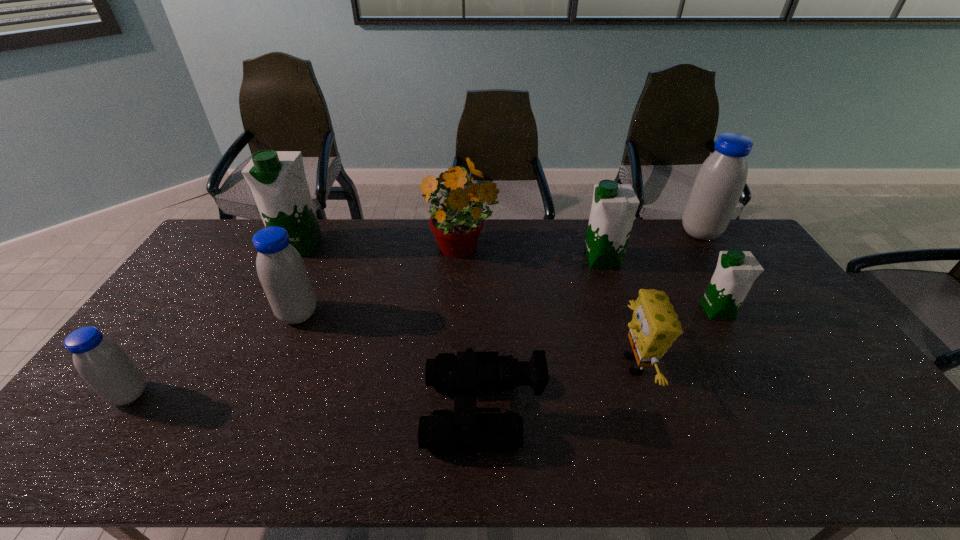
The width and height of the screenshot is (960, 540). What are the coordinates of `free space located 0.090m on the front lenses of the shortest object` in the screenshot? It's located at (389, 410).

Locate an element on the screen. The image size is (960, 540). flowerpot that is at the far edge is located at coordinates (456, 226).

I want to click on object that is at the near edge, so click(469, 372).

Find the location of `object at the left edge`. object at the left edge is located at coordinates (103, 364).

Identify the location of object located at the right edge. This screenshot has height=540, width=960. (719, 183).

You are a GUI agent. You are given a task and a screenshot of the screen. Output one action in this format:
    pyautogui.click(x=<x>, y=<y>)
    Task: Click on the object located at the far right corner
    The width and height of the screenshot is (960, 540).
    Given the screenshot: What is the action you would take?
    pyautogui.click(x=719, y=183)

You are a GUI agent. You are given a task and a screenshot of the screen. Output one action in this format:
    pyautogui.click(x=<x>, y=<y>)
    Task: Click on the free space at the near edge
    This screenshot has height=540, width=960.
    Given the screenshot: What is the action you would take?
    pyautogui.click(x=329, y=465)

Where is `vacant space at the left edge of the desktop`? The width and height of the screenshot is (960, 540). vacant space at the left edge of the desktop is located at coordinates (196, 272).

Identify the location of vacant space in between the binoculars and the second smallest blue soya milk. (391, 362).

Image resolution: width=960 pixels, height=540 pixels. In order to click on free area in between the rightmost green soya milk and the fourth soya milk from left to right in this screenshot , I will do `click(660, 285)`.